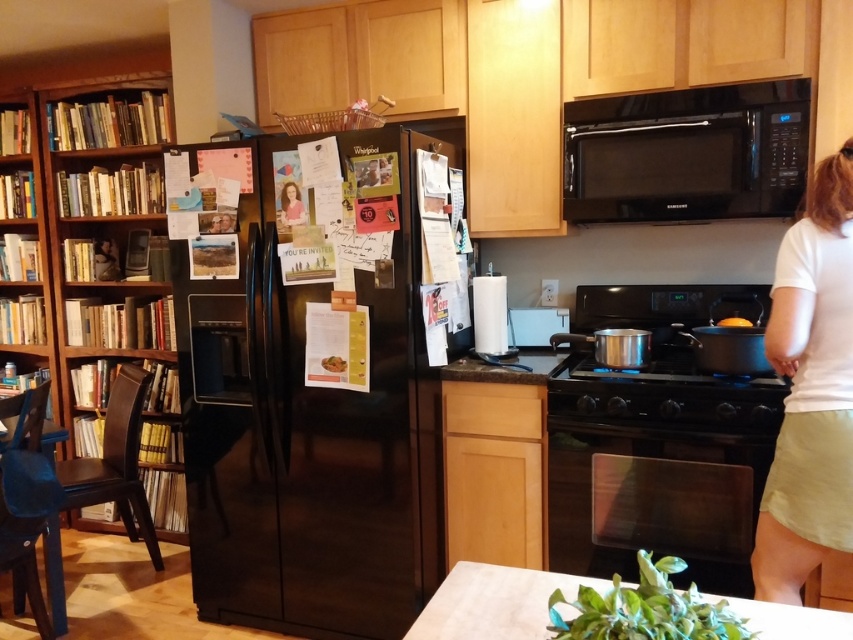
Does black matte refrigerator at center come behind white matte countertop at lower center?

Yes, black matte refrigerator at center is further from the viewer.

Is black matte refrigerator at center thinner than white matte countertop at lower center?

Incorrect, black matte refrigerator at center's width is not less than white matte countertop at lower center's.

Describe the element at coordinates (300, 419) in the screenshot. I see `black matte refrigerator at center` at that location.

This screenshot has width=853, height=640. In order to click on black matte refrigerator at center in this screenshot , I will do `click(300, 419)`.

Is wooden bookshelf at left closer to camera compared to black glossy microwave at upper center?

No, wooden bookshelf at left is further to the viewer.

Who is more distant from viewer, (x=131, y=337) or (x=659, y=170)?

Point (x=131, y=337)

In order to click on wooden bookshelf at left in this screenshot , I will do `click(102, 236)`.

Can you confirm if wooden bookshelf at left is thinner than white cotton shirt at right?

In fact, wooden bookshelf at left might be wider than white cotton shirt at right.

Between wooden bookshelf at left and white cotton shirt at right, which one appears on the right side from the viewer's perspective?

Positioned to the right is white cotton shirt at right.

Identify the location of wooden bookshelf at left. click(102, 236).